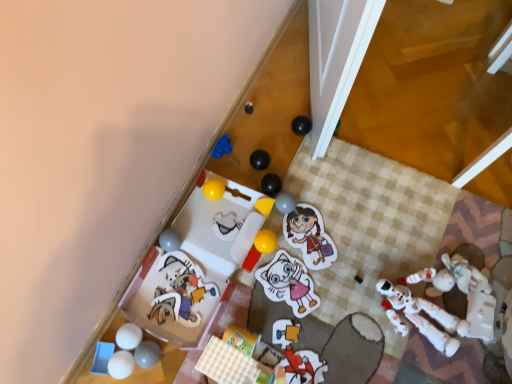
Image resolution: width=512 pixels, height=384 pixels. What do you see at coordinates (222, 147) in the screenshot?
I see `blue rubber toy at upper center, acting as the 9th toy starting from the right` at bounding box center [222, 147].

This screenshot has height=384, width=512. In order to click on matte gray ball at lower left, which is counted as the twelfth toy, starting from the right in this screenshot , I will do `click(147, 354)`.

Looking at this image, measure the distance between point (197, 294) and camera.

The depth of point (197, 294) is 1.23 meters.

Where is `blue plastic tray at lower left, placed as the first toy when sorted from left to right`? blue plastic tray at lower left, placed as the first toy when sorted from left to right is located at coordinates (102, 357).

Locate an element on the screen. This screenshot has height=384, width=512. yellow rubber ball at center, arranged as the fourth toy when viewed from the right is located at coordinates (265, 241).

You are a GUI agent. You are given a task and a screenshot of the screen. Output one action in this format:
    pyautogui.click(x=<x>, y=<y>)
    Task: Click on the black rubber ball at center, which appears as the tenth toy when viewed from the left
    The image size is (512, 384).
    Given the screenshot: What is the action you would take?
    pyautogui.click(x=260, y=159)

I want to click on blue rubber toy at upper center, acting as the 9th toy starting from the right, so click(222, 147).

Visually, is white matte cat at center, which is counted as the 2th toy, starting from the right, positioned to the left or to the right of cartoon cat plush at lower left, placed as the 11th toy when sorted from right to left?

Based on their positions, white matte cat at center, which is counted as the 2th toy, starting from the right, is located to the right of cartoon cat plush at lower left, placed as the 11th toy when sorted from right to left.

Is white matte cat at center, which is counted as the 2th toy, starting from the right, further to camera compared to cartoon cat plush at lower left, placed as the 11th toy when sorted from right to left?

Yes, it is behind cartoon cat plush at lower left, placed as the 11th toy when sorted from right to left.

From the image's perspective, is white matte cat at center, which is counted as the 2th toy, starting from the right, located above or below cartoon cat plush at lower left, positioned as the 5th toy in left-to-right order?

Based on their image positions, white matte cat at center, which is counted as the 2th toy, starting from the right, is located above cartoon cat plush at lower left, positioned as the 5th toy in left-to-right order.

Is white matte cat at center, placed as the fourteenth toy when sorted from left to right, far away from cartoon cat plush at lower left, positioned as the 5th toy in left-to-right order?

No, there isn't a large distance between white matte cat at center, placed as the fourteenth toy when sorted from left to right, and cartoon cat plush at lower left, positioned as the 5th toy in left-to-right order.

Considering the sizes of objects rubber matte ball at center, which ranks as the thirteenth toy in left-to-right order, and yellow rubber ball at center, the tenth toy when ordered from right to left, in the image provided, who is smaller, rubber matte ball at center, which ranks as the thirteenth toy in left-to-right order, or yellow rubber ball at center, the tenth toy when ordered from right to left,?

With smaller size is yellow rubber ball at center, the tenth toy when ordered from right to left.

Between point (295, 205) and point (223, 185), which one is positioned behind?

Positioned behind is point (223, 185).

Is rubber matte ball at center, marked as the third toy in a right-to-left arrangement, turned away from yellow rubber ball at center, the tenth toy when ordered from right to left?

Yes.

Would you say yellow rubber ball at center, placed as the 6th toy when sorted from left to right, is part of rubber matte ball at center, which ranks as the thirteenth toy in left-to-right order,'s contents?

That's incorrect, yellow rubber ball at center, placed as the 6th toy when sorted from left to right, is not inside rubber matte ball at center, which ranks as the thirteenth toy in left-to-right order.

Is blue rubber toy at upper center, acting as the 9th toy starting from the right, not within white matte ball at lower left, the thirteenth toy in the right-to-left sequence?

Yes, blue rubber toy at upper center, acting as the 9th toy starting from the right, is not within white matte ball at lower left, the thirteenth toy in the right-to-left sequence.

Which of these two, blue rubber toy at upper center, arranged as the seventh toy when viewed from the left, or white matte ball at lower left, arranged as the third toy when viewed from the left, is smaller?

blue rubber toy at upper center, arranged as the seventh toy when viewed from the left.

In terms of height, does blue rubber toy at upper center, arranged as the seventh toy when viewed from the left, look taller or shorter compared to white matte ball at lower left, the thirteenth toy in the right-to-left sequence?

blue rubber toy at upper center, arranged as the seventh toy when viewed from the left, is shorter than white matte ball at lower left, the thirteenth toy in the right-to-left sequence.

This screenshot has height=384, width=512. Find the location of `the 10th toy above the white matte ball at lower left, the thirteenth toy in the right-to-left sequence (from the image's perspective)`. the 10th toy above the white matte ball at lower left, the thirteenth toy in the right-to-left sequence (from the image's perspective) is located at coordinates (222, 147).

Is yellow rubber ball at center, the tenth toy when ordered from right to left, facing towards yellow matte block at upper center, placed as the 11th toy when sorted from left to right?

Yes, yellow rubber ball at center, the tenth toy when ordered from right to left, is aimed at yellow matte block at upper center, placed as the 11th toy when sorted from left to right.

Which is more to the right, yellow rubber ball at center, placed as the 6th toy when sorted from left to right, or yellow matte block at upper center, placed as the 11th toy when sorted from left to right?

yellow matte block at upper center, placed as the 11th toy when sorted from left to right.

Considering the relative sizes of yellow rubber ball at center, the tenth toy when ordered from right to left, and yellow matte block at upper center, which is the fifth toy in right-to-left order, in the image provided, is yellow rubber ball at center, the tenth toy when ordered from right to left, bigger than yellow matte block at upper center, which is the fifth toy in right-to-left order,?

Yes, yellow rubber ball at center, the tenth toy when ordered from right to left, is bigger than yellow matte block at upper center, which is the fifth toy in right-to-left order.

From the image's perspective, is yellow rubber ball at center, placed as the 6th toy when sorted from left to right, below yellow matte block at upper center, placed as the 11th toy when sorted from left to right?

No, from the image's perspective, yellow rubber ball at center, placed as the 6th toy when sorted from left to right, is not below yellow matte block at upper center, placed as the 11th toy when sorted from left to right.

Is yellow matte block at upper center, which is the fifth toy in right-to-left order, bigger than white matte cat at center, which is counted as the 2th toy, starting from the right?

Incorrect, yellow matte block at upper center, which is the fifth toy in right-to-left order, is not larger than white matte cat at center, which is counted as the 2th toy, starting from the right.

Is yellow matte block at upper center, which is the fifth toy in right-to-left order, positioned with its back to white matte cat at center, which is counted as the 2th toy, starting from the right?

No, white matte cat at center, which is counted as the 2th toy, starting from the right, is not at the back of yellow matte block at upper center, which is the fifth toy in right-to-left order.

From the image's perspective, which object appears higher, yellow matte block at upper center, which is the fifth toy in right-to-left order, or white matte cat at center, which is counted as the 2th toy, starting from the right?

yellow matte block at upper center, which is the fifth toy in right-to-left order, is shown above in the image.

Is yellow matte block at upper center, which is the fifth toy in right-to-left order, inside or outside of white matte cat at center, placed as the fourteenth toy when sorted from left to right?

yellow matte block at upper center, which is the fifth toy in right-to-left order, cannot be found inside white matte cat at center, placed as the fourteenth toy when sorted from left to right.

In terms of height, does white rubber ball at lower left, which is the fourteenth toy from right to left, look taller or shorter compared to matte plastic toy at center, arranged as the eighth toy when viewed from the right?

white rubber ball at lower left, which is the fourteenth toy from right to left, is taller than matte plastic toy at center, arranged as the eighth toy when viewed from the right.

Which is more to the left, white rubber ball at lower left, which is the fourteenth toy from right to left, or matte plastic toy at center, arranged as the eighth toy when viewed from the right?

From the viewer's perspective, white rubber ball at lower left, which is the fourteenth toy from right to left, appears more on the left side.

Measure the distance from white rubber ball at lower left, which appears as the second toy when viewed from the left, to matte plastic toy at center, the 8th toy when ordered from left to right.

The distance of white rubber ball at lower left, which appears as the second toy when viewed from the left, from matte plastic toy at center, the 8th toy when ordered from left to right, is 44.74 centimeters.

Between white matte ball at lower left, the thirteenth toy in the right-to-left sequence, and black rubber ball at center, which appears as the tenth toy when viewed from the left, which one has smaller width?

Thinner between the two is white matte ball at lower left, the thirteenth toy in the right-to-left sequence.

Is white matte ball at lower left, arranged as the third toy when viewed from the left, touching black rubber ball at center, which appears as the tenth toy when viewed from the left?

No, white matte ball at lower left, arranged as the third toy when viewed from the left, is not in contact with black rubber ball at center, which appears as the tenth toy when viewed from the left.

Who is bigger, white matte ball at lower left, the thirteenth toy in the right-to-left sequence, or black rubber ball at center, which appears as the tenth toy when viewed from the left?

black rubber ball at center, which appears as the tenth toy when viewed from the left, is bigger.

This screenshot has width=512, height=384. I want to click on toy that is the 1st one above the cartoon cat plush at lower left, positioned as the 5th toy in left-to-right order (from a real-world perspective), so click(x=289, y=283).

There is a yellow rubber ball at center, the tenth toy when ordered from right to left. Identify the location of the 1st toy below it (from the image's perspective). pyautogui.click(x=285, y=202).

Looking at the image, which one is located further to white matte ball at lower left, the thirteenth toy in the right-to-left sequence, matte plastic toy at center, arranged as the eighth toy when viewed from the right, or rubber matte ball at center, which ranks as the thirteenth toy in left-to-right order?

rubber matte ball at center, which ranks as the thirteenth toy in left-to-right order, is further to white matte ball at lower left, the thirteenth toy in the right-to-left sequence.

Based on their spatial positions, is matte gray ball at lower left, which is counted as the twelfth toy, starting from the right, or white plastic toy at lower right, marked as the first toy in a right-to-left arrangement, closer to cartoon cat plush at lower left, positioned as the 5th toy in left-to-right order?

matte gray ball at lower left, which is counted as the twelfth toy, starting from the right, is closer to cartoon cat plush at lower left, positioned as the 5th toy in left-to-right order.

From the image, which object appears to be nearer to matte plastic toy at lower center, which is counted as the 9th toy, starting from the left, matte plastic toy at center, the 8th toy when ordered from left to right, or yellow matte block at upper center, which is the fifth toy in right-to-left order?

matte plastic toy at center, the 8th toy when ordered from left to right, is closer to matte plastic toy at lower center, which is counted as the 9th toy, starting from the left.

Based on their spatial positions, is yellow rubber ball at center, arranged as the fourth toy when viewed from the right, or white matte ball at lower left, arranged as the third toy when viewed from the left, further from matte plastic toy at lower center, which is counted as the 9th toy, starting from the left?

Based on the image, white matte ball at lower left, arranged as the third toy when viewed from the left, appears to be further to matte plastic toy at lower center, which is counted as the 9th toy, starting from the left.

When comparing their distances from blue rubber toy at upper center, arranged as the seventh toy when viewed from the left, does black rubber ball at center, which appears as the tenth toy when viewed from the left, or matte gray ball at lower left, acting as the fourth toy starting from the left, seem further?

matte gray ball at lower left, acting as the fourth toy starting from the left.

From the picture: Looking at the image, which one is located closer to white matte cat at center, which is counted as the 2th toy, starting from the right, white matte ball at lower left, the thirteenth toy in the right-to-left sequence, or rubber matte ball at center, marked as the third toy in a right-to-left arrangement?

rubber matte ball at center, marked as the third toy in a right-to-left arrangement, is closer to white matte cat at center, which is counted as the 2th toy, starting from the right.

Estimate the real-world distances between objects in this image. Which object is closer to blue rubber toy at upper center, acting as the 9th toy starting from the right, yellow matte block at upper center, placed as the 11th toy when sorted from left to right, or white plastic toy at lower right, the fifteenth toy viewed from the left?

yellow matte block at upper center, placed as the 11th toy when sorted from left to right, is positioned closer to the anchor blue rubber toy at upper center, acting as the 9th toy starting from the right.

Based on their spatial positions, is rubber matte ball at center, which ranks as the thirteenth toy in left-to-right order, or cartoon cat plush at lower left, placed as the 11th toy when sorted from right to left, closer to yellow matte block at upper center, which is the fifth toy in right-to-left order?

rubber matte ball at center, which ranks as the thirteenth toy in left-to-right order, lies closer to yellow matte block at upper center, which is the fifth toy in right-to-left order, than the other object.

Find the location of a particular element. The image size is (512, 384). toy between white rubber ball at lower left, which appears as the second toy when viewed from the left, and matte gray ball at lower left, which is counted as the twelfth toy, starting from the right, in the horizontal direction is located at coordinates (128, 336).

Where is `toy between rubber matte ball at center, marked as the third toy in a right-to-left arrangement, and white plastic toy at lower right, marked as the first toy in a right-to-left arrangement`? The height and width of the screenshot is (384, 512). toy between rubber matte ball at center, marked as the third toy in a right-to-left arrangement, and white plastic toy at lower right, marked as the first toy in a right-to-left arrangement is located at coordinates (289, 283).

You are a GUI agent. You are given a task and a screenshot of the screen. Output one action in this format:
    pyautogui.click(x=<x>, y=<y>)
    Task: Click on the toy located between blue plastic tray at lower left, placed as the first toy when sorted from left to right, and white matte ball at lower left, the thirteenth toy in the right-to-left sequence, in the left-right direction
    
    Given the screenshot: What is the action you would take?
    pyautogui.click(x=121, y=364)